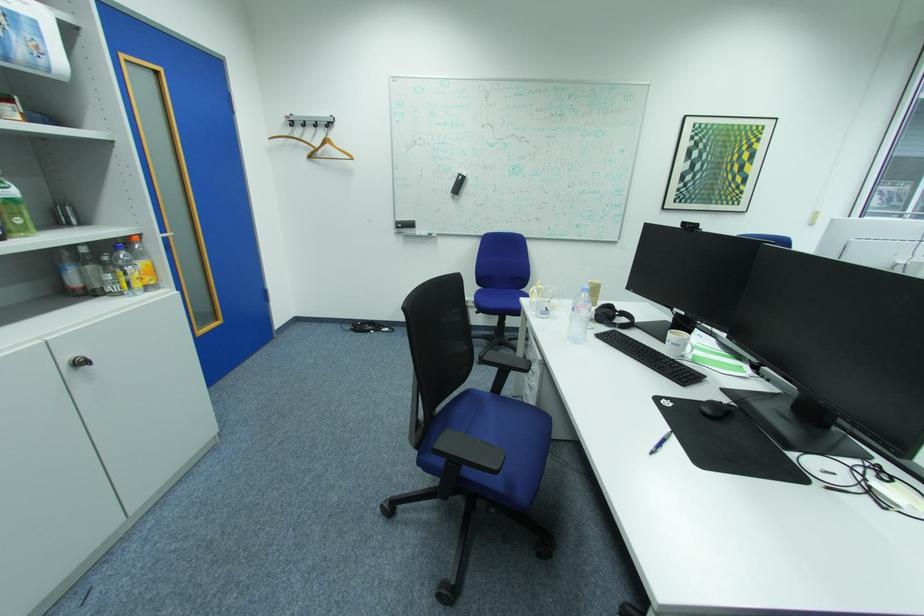
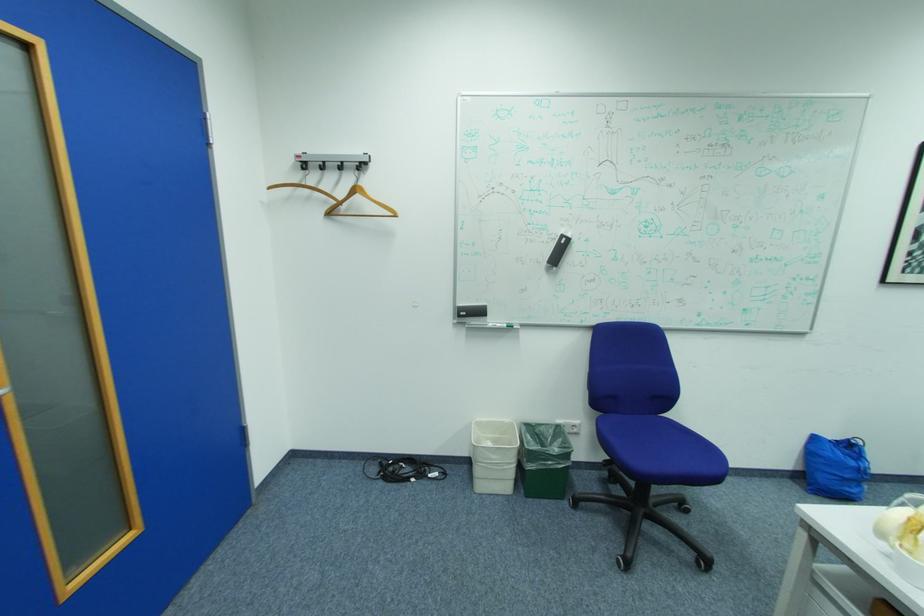
Where in the second image is the point corresponding to (x=335, y=146) from the first image?

(366, 197)